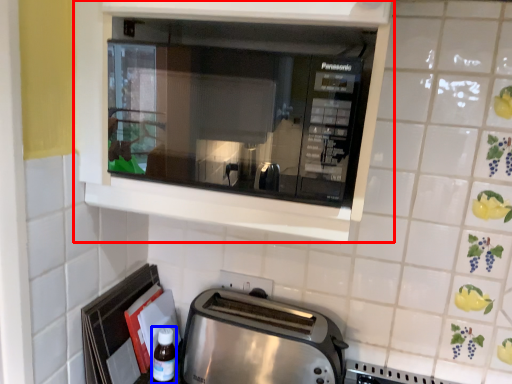
Question: Among these objects, which one is nearest to the camera, cabinetry (highlighted by a red box) or bottle (highlighted by a blue box)?

Choices:
 (A) cabinetry
 (B) bottle

Answer: (A)